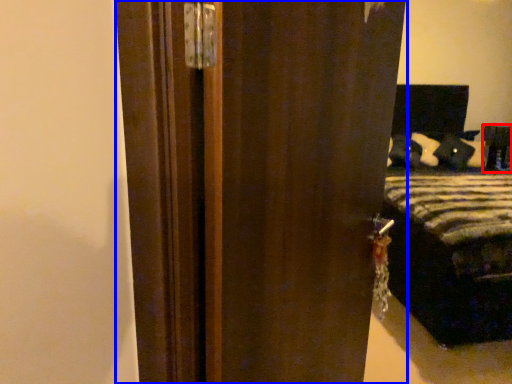
Question: Which object is closer to the camera taking this photo, furniture (highlighted by a red box) or door (highlighted by a blue box)?

Choices:
 (A) furniture
 (B) door

Answer: (B)